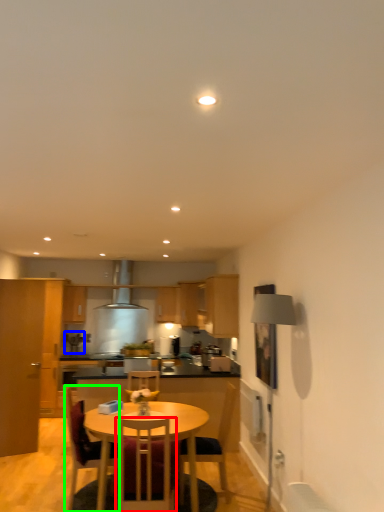
Question: Based on their relative distances, which object is farther from chair (highlighted by a red box)? Choose from coffee machine (highlighted by a blue box) and chair (highlighted by a green box).

Choices:
 (A) coffee machine
 (B) chair

Answer: (A)